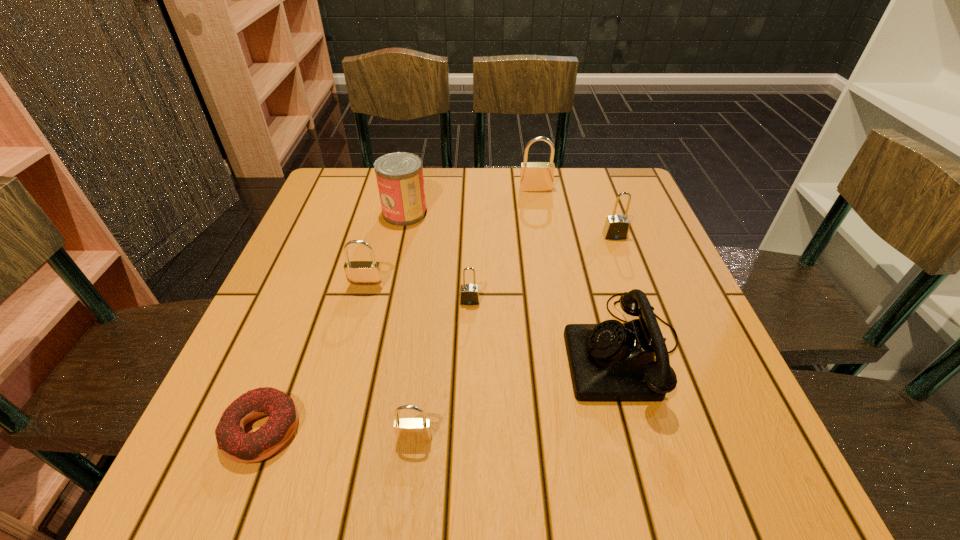
Find the location of a particular element. free spot between the can and the nearest padlock is located at coordinates (410, 325).

Where is `blank region between the can and the second padlock from right to left`? Image resolution: width=960 pixels, height=540 pixels. blank region between the can and the second padlock from right to left is located at coordinates (470, 201).

This screenshot has height=540, width=960. I want to click on free space between the seventh nearest object and the fourth padlock from right to left, so click(410, 325).

Image resolution: width=960 pixels, height=540 pixels. In order to click on unoccupied area between the chocolate doughnut and the smallest brass padlock in this screenshot , I will do `click(338, 434)`.

At what (x,y) coordinates should I click in order to perform the action: click on free space between the chocolate doughnut and the right gray padlock. Please return your answer as a coordinate pair (x, y). This screenshot has width=960, height=540. Looking at the image, I should click on (439, 333).

Find the location of a particular element. free spot between the second brass padlock from right to left and the left gray padlock is located at coordinates (442, 369).

I want to click on the fourth closest object to the farthest padlock, so click(x=469, y=293).

The image size is (960, 540). In order to click on object that is the fourth nearest to the second farthest object in this screenshot , I will do `click(611, 361)`.

Identify the location of padlock that stands as the closest to the shortest object. The width and height of the screenshot is (960, 540). (407, 430).

What are the coordinates of `padlock that is the third closest to the second nearest padlock` in the screenshot? It's located at (616, 227).